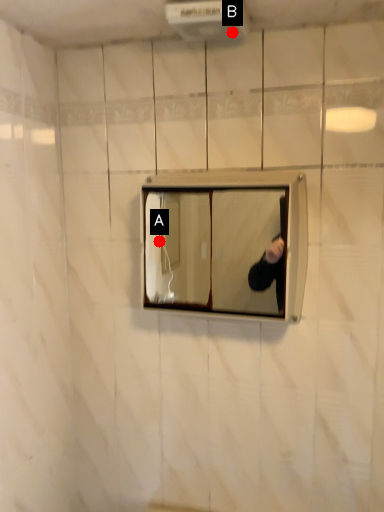
Question: Two points are circled on the image, labeled by A and B beside each circle. Which point is closer to the camera?

Choices:
 (A) A is closer
 (B) B is closer

Answer: (B)